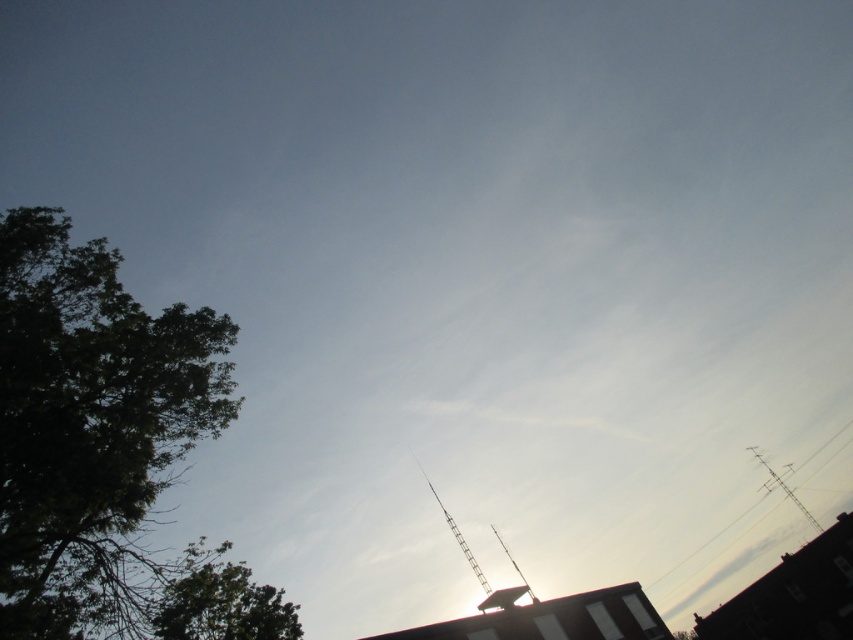
Does green leafy tree at left appear on the left side of metallic wire at upper right?

Indeed, green leafy tree at left is positioned on the left side of metallic wire at upper right.

Which is above, green leafy tree at left or metallic wire at upper right?

Positioned higher is green leafy tree at left.

Who is more distant from viewer, (x=140, y=608) or (x=706, y=563)?

The point (x=706, y=563) is more distant.

The width and height of the screenshot is (853, 640). I want to click on green leafy tree at left, so click(x=90, y=426).

Looking at this image, can you confirm if green leafy tree at left is positioned above green leafy tree at lower left?

Yes, green leafy tree at left is above green leafy tree at lower left.

Who is lower down, green leafy tree at left or green leafy tree at lower left?

Positioned lower is green leafy tree at lower left.

This screenshot has width=853, height=640. Identify the location of green leafy tree at left. (90, 426).

Is point (209, 604) behind point (809, 460)?

No, (209, 604) is in front of (809, 460).

The height and width of the screenshot is (640, 853). What are the coordinates of `green leafy tree at lower left` in the screenshot? It's located at (219, 602).

This screenshot has height=640, width=853. Identify the location of green leafy tree at lower left. (219, 602).